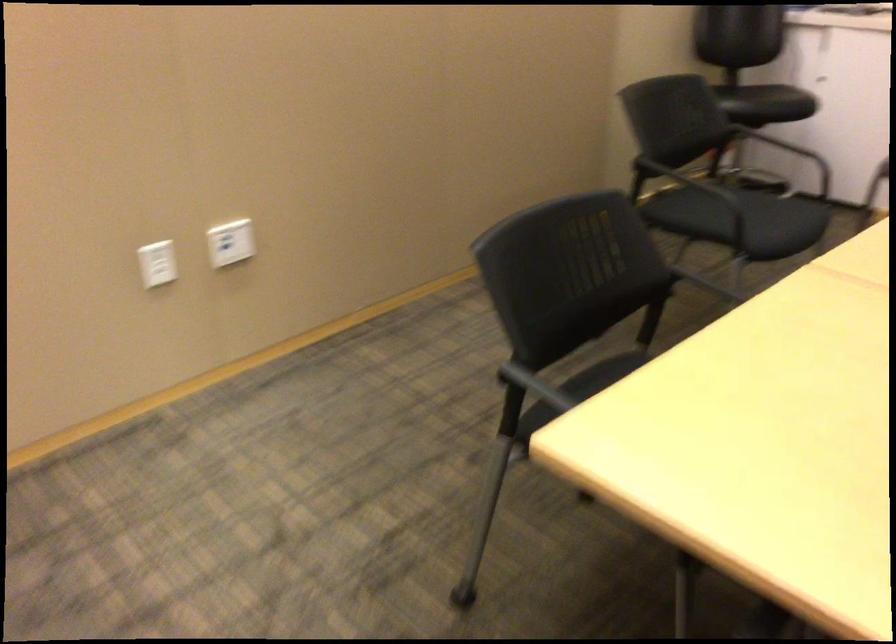
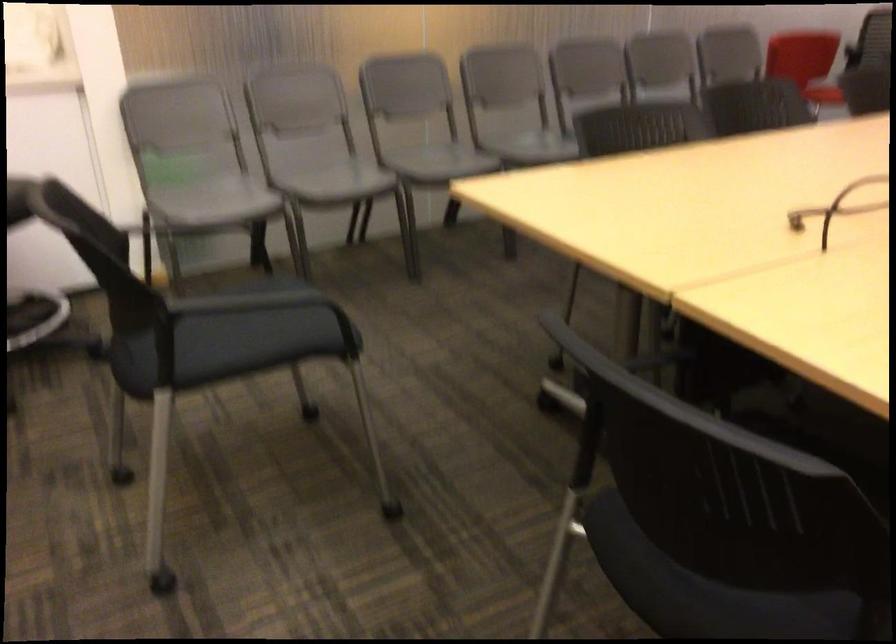
The point at (728, 212) is marked in the first image. Where is the corresponding point in the second image?

(235, 336)